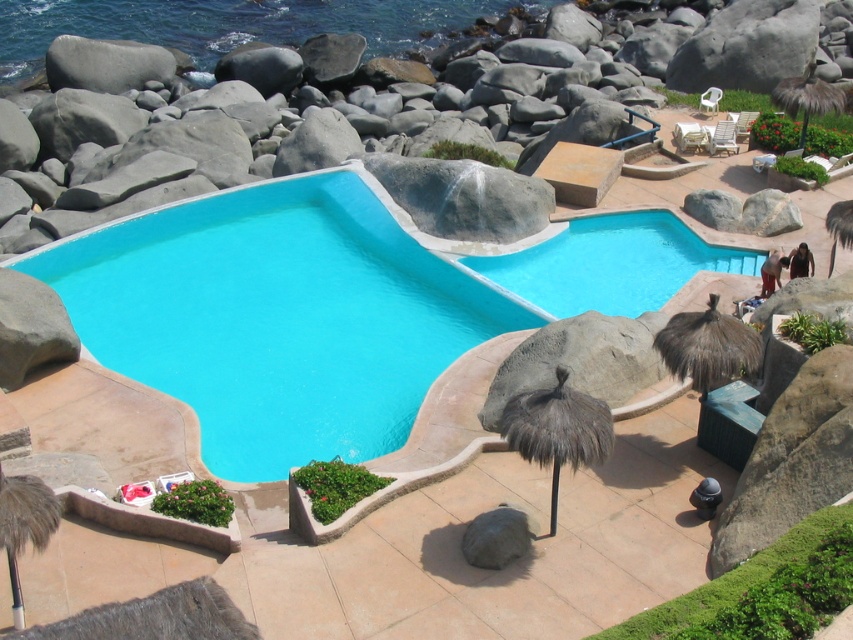
Question: Which point appears farthest from the camera in this image?

Choices:
 (A) (22, 19)
 (B) (666, 355)
 (C) (613, 282)

Answer: (A)

Question: Which point is closer to the camera?

Choices:
 (A) blue concrete pool at center
 (B) brown/thatched umbrella at right

Answer: (B)

Question: Is blue smooth pool at center positioned before brown feathered umbrella at lower left?

Choices:
 (A) yes
 (B) no

Answer: (B)

Question: Does blue concrete pool at center appear over brown feathered umbrella at lower left?

Choices:
 (A) no
 (B) yes

Answer: (B)

Question: Is blue smooth pool at center above dark grey thatched umbrella at center?

Choices:
 (A) no
 (B) yes

Answer: (B)

Question: Estimate the real-world distances between objects in this image. Which object is closer to the brown feathered umbrella at lower left?

Choices:
 (A) smooth concrete pool at center
 (B) blue concrete pool at center

Answer: (B)